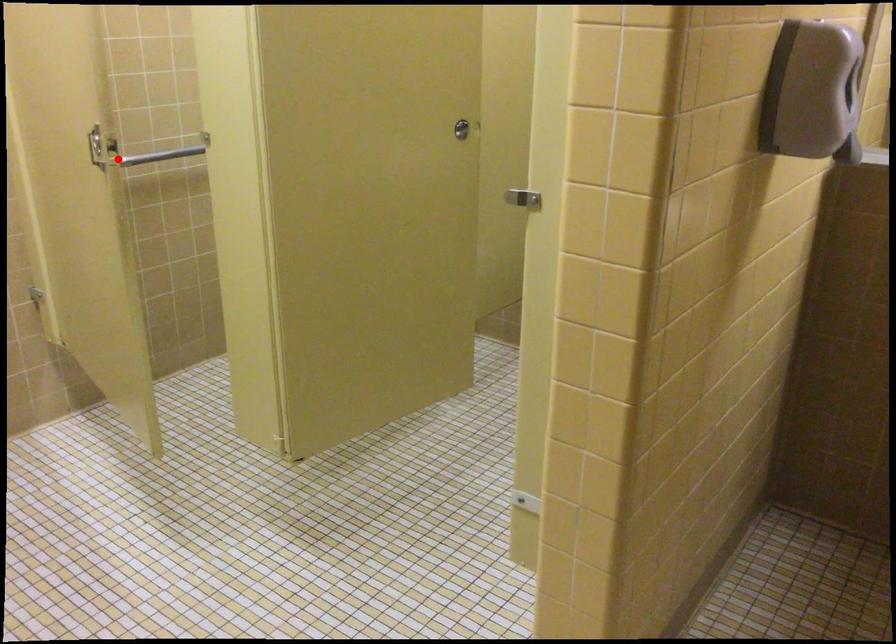
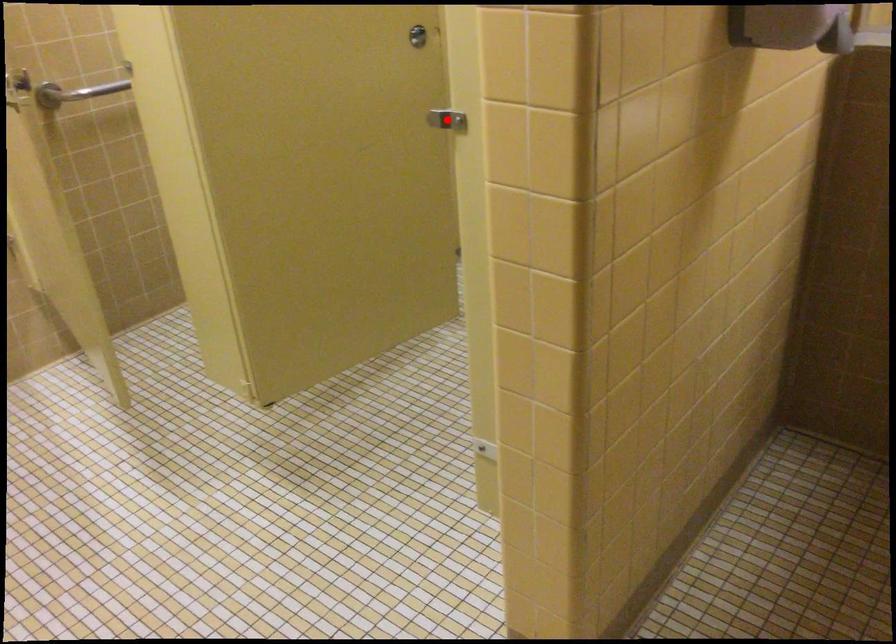
I am providing you with two images of the same scene from different viewpoints. A red point is marked on the first image and another point is marked on the second image. Do the highlighted points in image1 and image2 indicate the same real-world spot?

No